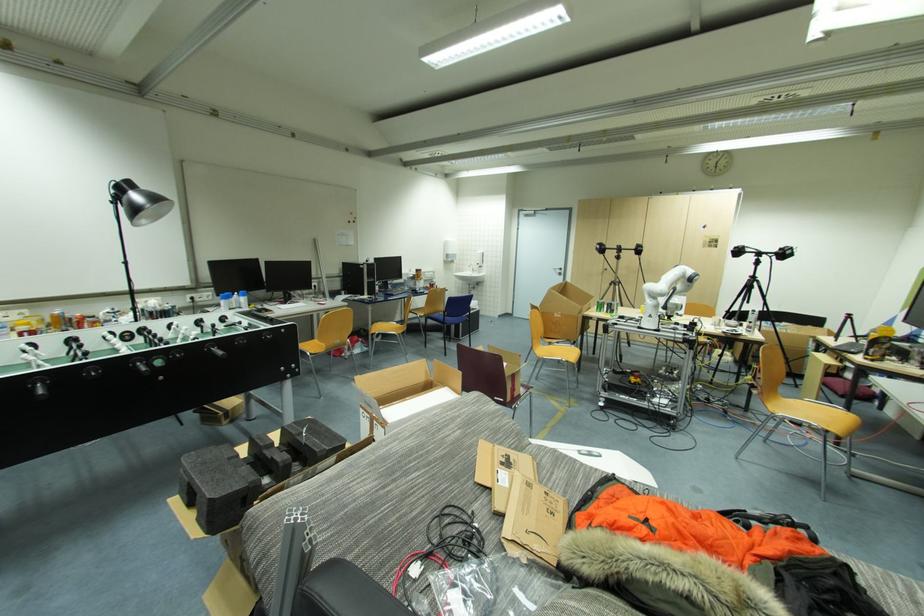
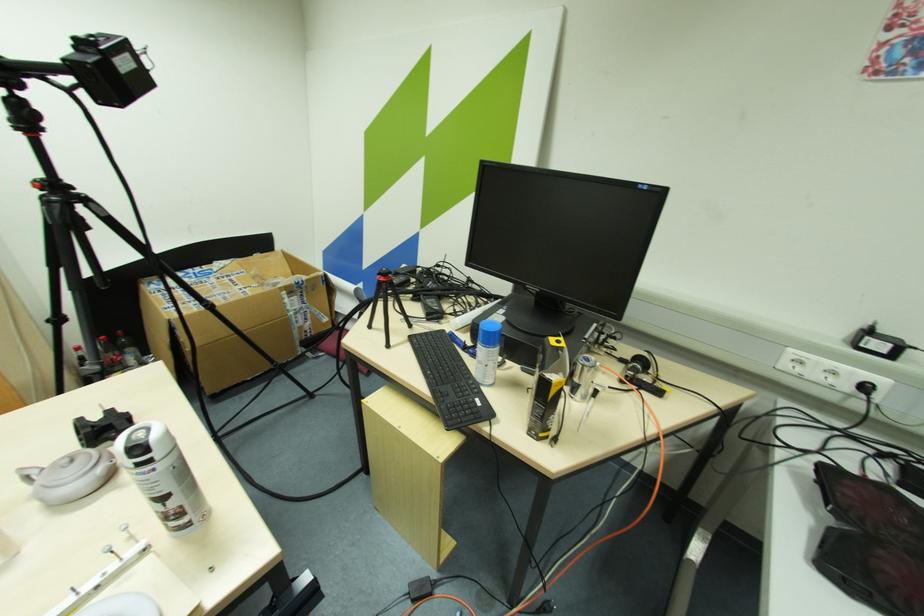
Locate, in the second image, the point that corresponds to point 754,323 in the first image.

(164, 500)